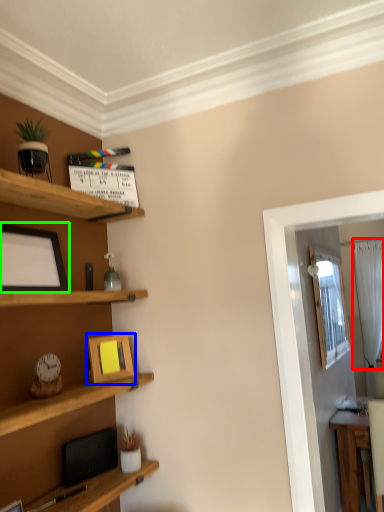
Question: Which object is the closest to the curtain (highlighted by a red box)? Choose among these: picture frame (highlighted by a blue box) or picture frame (highlighted by a green box).

Choices:
 (A) picture frame
 (B) picture frame

Answer: (A)